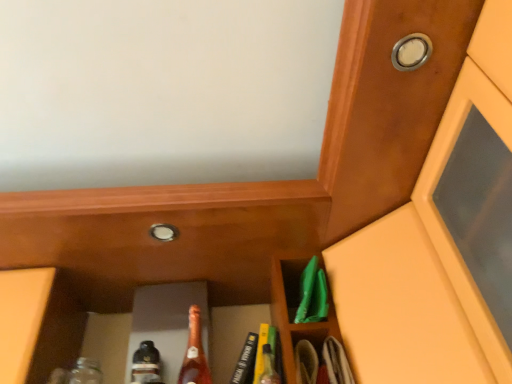
Locate an element on the screen. The image size is (512, 384). blank space situated above wooden door at upper right (from a real-world perspective) is located at coordinates (410, 120).